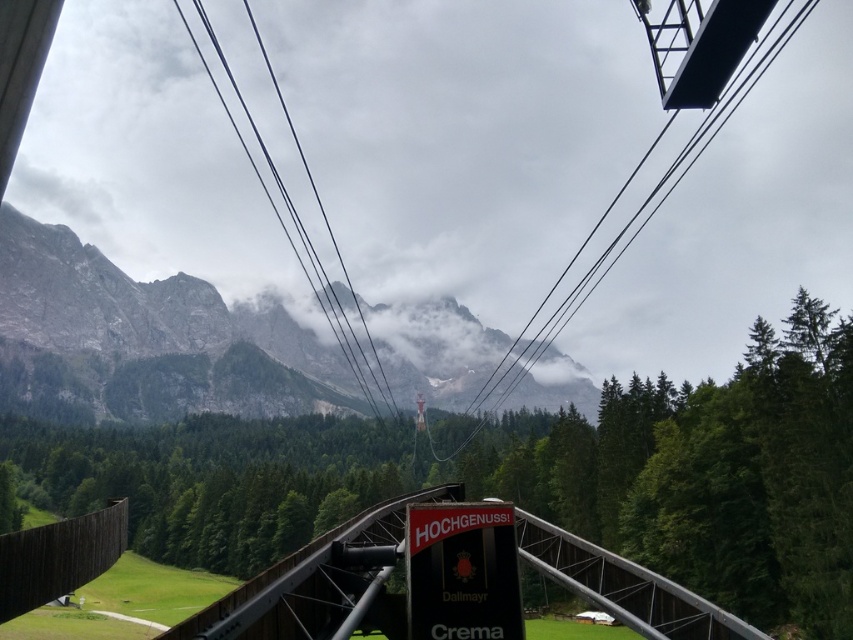
Question: Is metallic wire at upper center to the right of black wire at center from the viewer's perspective?

Choices:
 (A) yes
 (B) no

Answer: (A)

Question: From the image, what is the correct spatial relationship of metallic bridge at center in relation to black wire at center?

Choices:
 (A) left
 (B) right

Answer: (B)

Question: Among these points, which one is nearest to the camera?

Choices:
 (A) (579, 580)
 (B) (216, 54)
 (C) (281, 396)
 (D) (492, 404)

Answer: (A)

Question: Which of the following is the closest to the observer?

Choices:
 (A) (367, 362)
 (B) (532, 358)
 (C) (392, 515)

Answer: (C)

Question: Among these objects, which one is nearest to the camera?

Choices:
 (A) metallic bridge at center
 (B) rocky gray mountain at upper left
 (C) black wire at center
 (D) metallic wire at upper center

Answer: (A)

Question: Observing the image, what is the correct spatial positioning of metallic bridge at center in reference to metallic wire at upper center?

Choices:
 (A) right
 (B) left

Answer: (B)